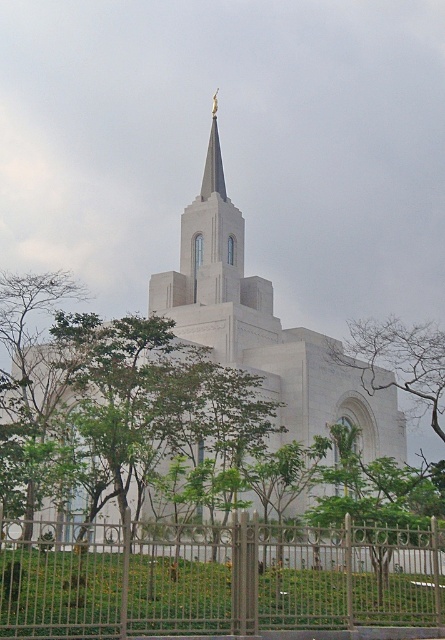
Question: Which point is farther to the camera?

Choices:
 (A) gold polished spire at center
 (B) green leafy tree at center
 (C) white stone church at center
 (D) metallic silver fence at lower center

Answer: (A)

Question: Is green leafy tree at center positioned in front of gold polished spire at center?

Choices:
 (A) yes
 (B) no

Answer: (A)

Question: Among these objects, which one is nearest to the camera?

Choices:
 (A) gold polished spire at center
 (B) white stone church at center
 (C) green leafy tree at center
 (D) metallic silver fence at lower center

Answer: (D)

Question: Where is white stone church at center located in relation to green leafy tree at center in the image?

Choices:
 (A) below
 (B) above

Answer: (A)

Question: Which object appears closest to the camera in this image?

Choices:
 (A) white stone church at center
 (B) green leafy tree at center
 (C) gold polished spire at center

Answer: (A)

Question: In this image, where is white stone church at center located relative to green leafy tree at center?

Choices:
 (A) left
 (B) right

Answer: (A)